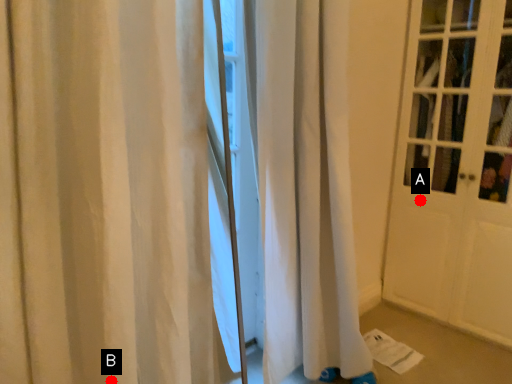
Question: Two points are circled on the image, labeled by A and B beside each circle. Which point is farther from the camera taking this photo?

Choices:
 (A) A is further
 (B) B is further

Answer: (A)